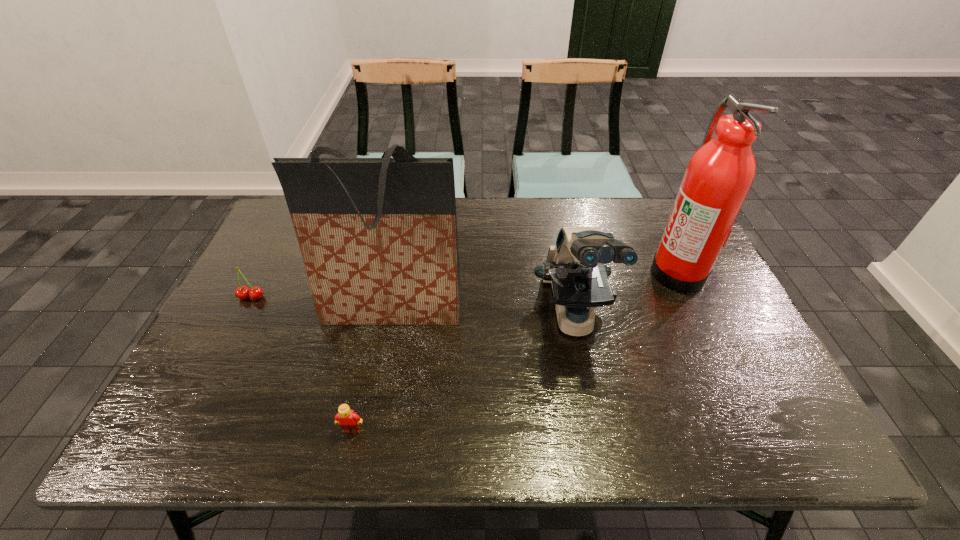
Where is `free location that satisfies the following two spatial constraints: 1. on the label side of the rightmost object; 2. on the front-facing side of the shopping bag`? Image resolution: width=960 pixels, height=540 pixels. free location that satisfies the following two spatial constraints: 1. on the label side of the rightmost object; 2. on the front-facing side of the shopping bag is located at coordinates (695, 308).

Where is `free location that satisfies the following two spatial constraints: 1. on the label side of the fire extinguisher; 2. on the face of the Lego`? free location that satisfies the following two spatial constraints: 1. on the label side of the fire extinguisher; 2. on the face of the Lego is located at coordinates (752, 430).

Identify the location of free space that satisfies the following two spatial constraints: 1. on the label side of the rightmost object; 2. with the stems of the cherry pointing upwards. Image resolution: width=960 pixels, height=540 pixels. (690, 298).

The width and height of the screenshot is (960, 540). I want to click on vacant space that satisfies the following two spatial constraints: 1. on the label side of the rightmost object; 2. with the stems of the leftmost object pointing upwards, so (690, 298).

Locate an element on the screen. vacant region that satisfies the following two spatial constraints: 1. on the label side of the fire extinguisher; 2. with the stems of the leftmost object pointing upwards is located at coordinates (690, 298).